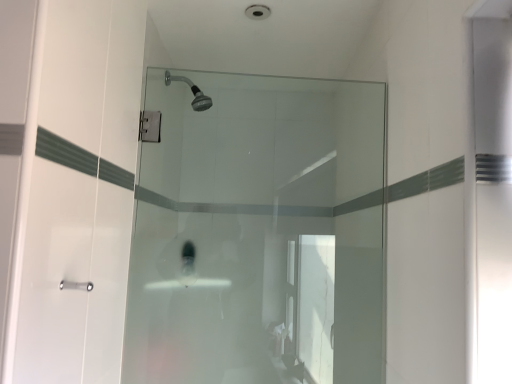
Find the location of `transparent glass shower door at center`. transparent glass shower door at center is located at coordinates (258, 232).

The height and width of the screenshot is (384, 512). What do you see at coordinates (258, 232) in the screenshot?
I see `transparent glass shower door at center` at bounding box center [258, 232].

Find the location of a particular element. The height and width of the screenshot is (384, 512). transparent glass shower door at center is located at coordinates (258, 232).